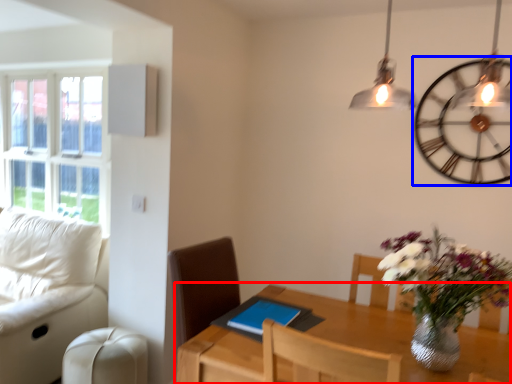
Question: Which object appears farthest to the camera in this image, table (highlighted by a red box) or wall clock (highlighted by a blue box)?

Choices:
 (A) table
 (B) wall clock

Answer: (B)